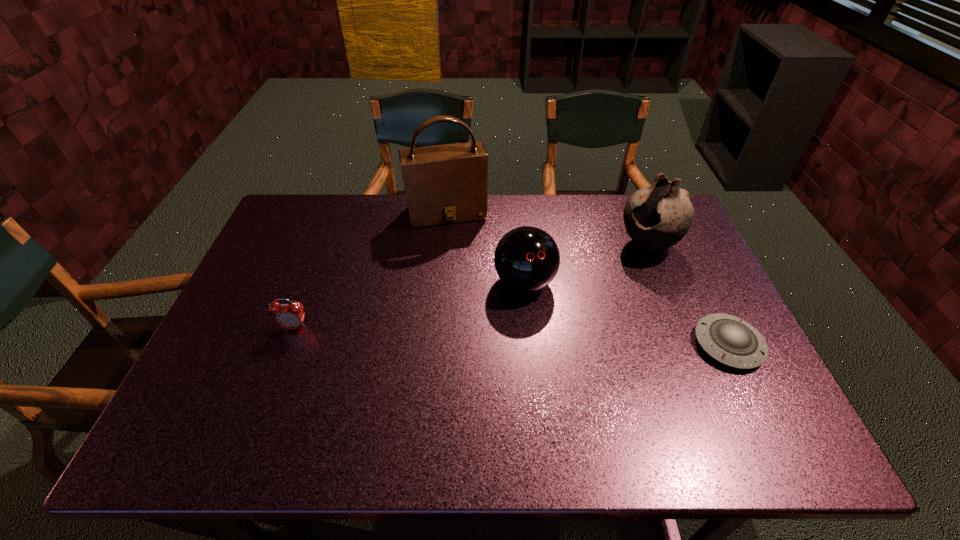
Where is `pottery positioned at the far edge`? pottery positioned at the far edge is located at coordinates (658, 216).

This screenshot has width=960, height=540. I want to click on object that is at the left edge, so click(290, 316).

Find the location of a particular element. saucer that is at the right edge is located at coordinates (730, 340).

This screenshot has width=960, height=540. Identify the location of pottery at the right edge. (658, 216).

The width and height of the screenshot is (960, 540). I want to click on object positioned at the far right corner, so click(x=658, y=216).

Locate an element on the screen. free region at the far edge of the desktop is located at coordinates (463, 226).

This screenshot has height=540, width=960. I want to click on vacant area at the near edge, so click(x=412, y=396).

In the image, there is a desktop. In order to click on vacant space at the left edge in this screenshot , I will do `click(301, 279)`.

At what (x,y) coordinates should I click in order to perform the action: click on blank space at the right edge. Please return your answer as a coordinate pair (x, y). Image resolution: width=960 pixels, height=540 pixels. Looking at the image, I should click on (675, 293).

The width and height of the screenshot is (960, 540). I want to click on free space at the far left corner of the desktop, so (313, 226).